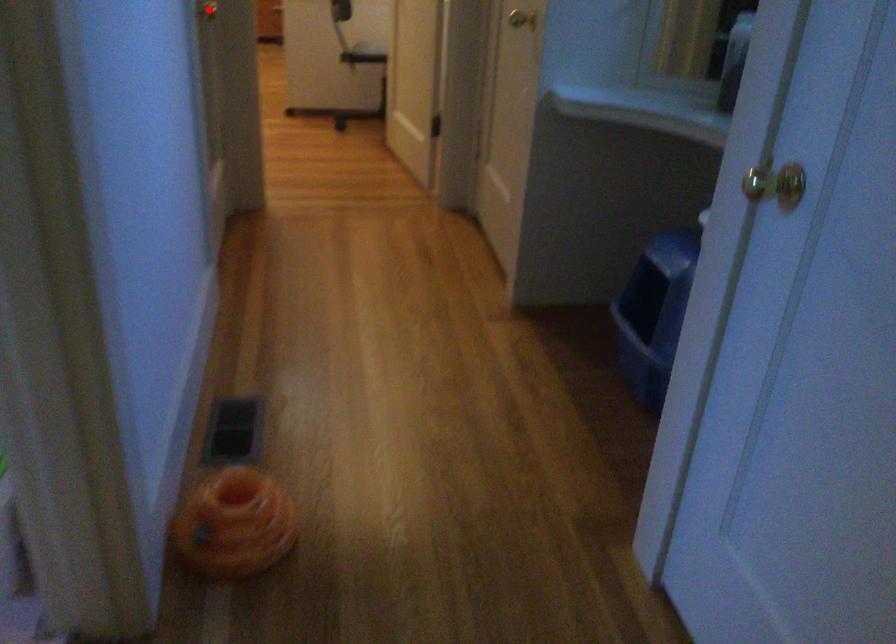
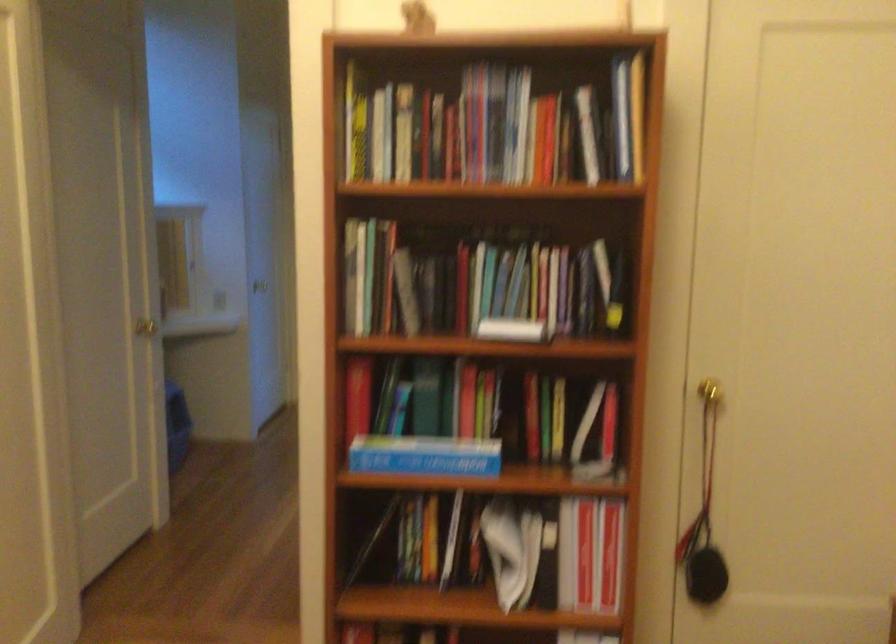
Question: I am providing you with two images of the same scene from different viewpoints. A red point is marked on the first image. Is the red point's position out of view in image 2?

Choices:
 (A) Yes
 (B) No

Answer: (A)